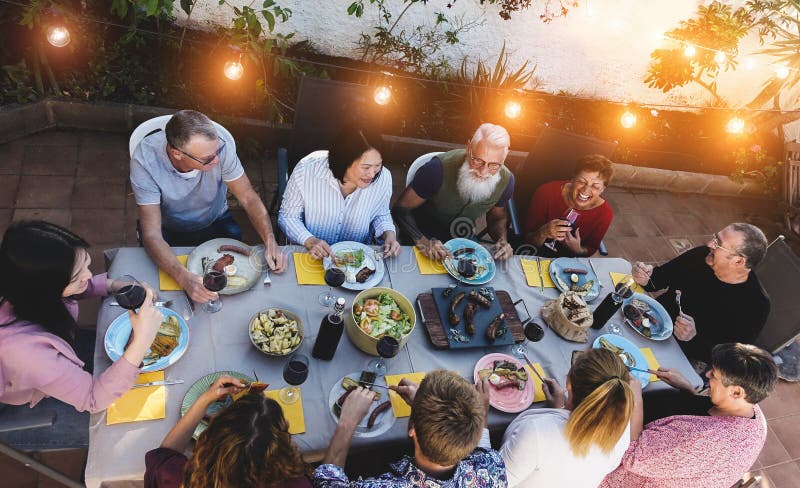
Identify the location of lights. Image resolution: width=800 pixels, height=488 pixels. (57, 37), (234, 70), (386, 95), (510, 108), (630, 117), (738, 130).